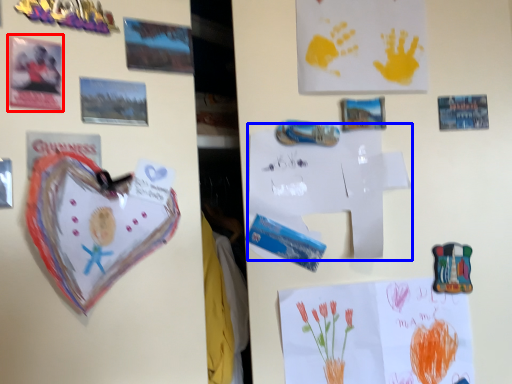
Question: Which object is closer to the camera taking this photo, postcard (highlighted by a red box) or paper (highlighted by a blue box)?

Choices:
 (A) postcard
 (B) paper

Answer: (A)